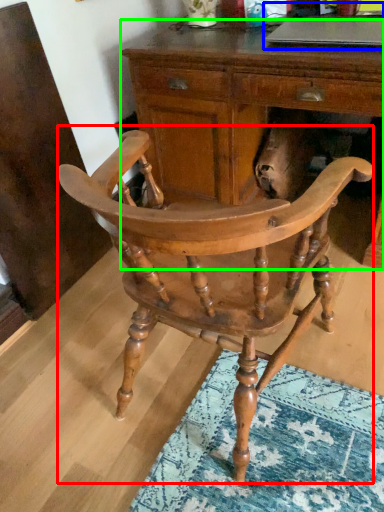
Question: Which is farther away from chair (highlighted by a red box)? computer (highlighted by a blue box) or desk (highlighted by a green box)?

Choices:
 (A) computer
 (B) desk

Answer: (A)